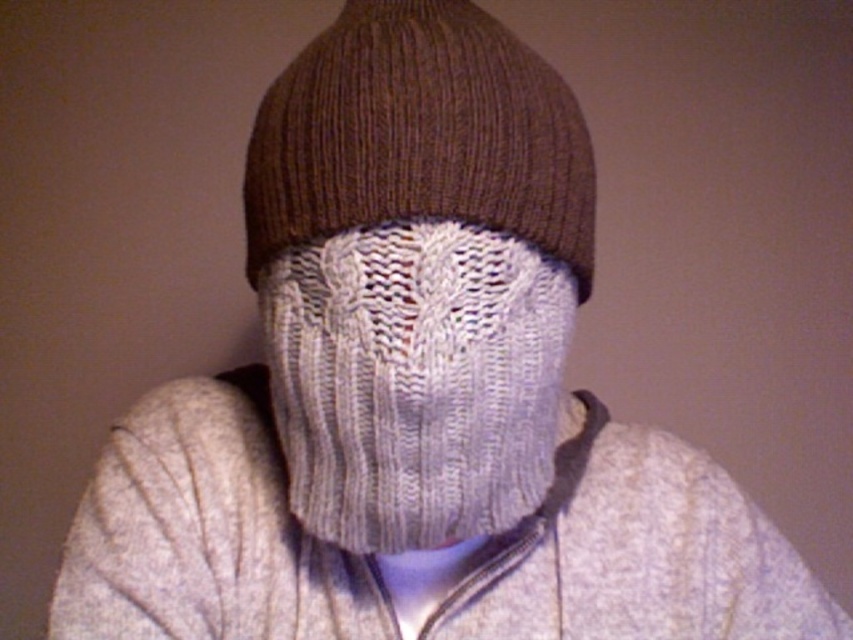
Is point (486, 448) positioned before point (459, 54)?

No, it is not.

At what (x,y) coordinates should I click in order to perform the action: click on white knitted scarf at center. Please return your answer as a coordinate pair (x, y). Looking at the image, I should click on (415, 380).